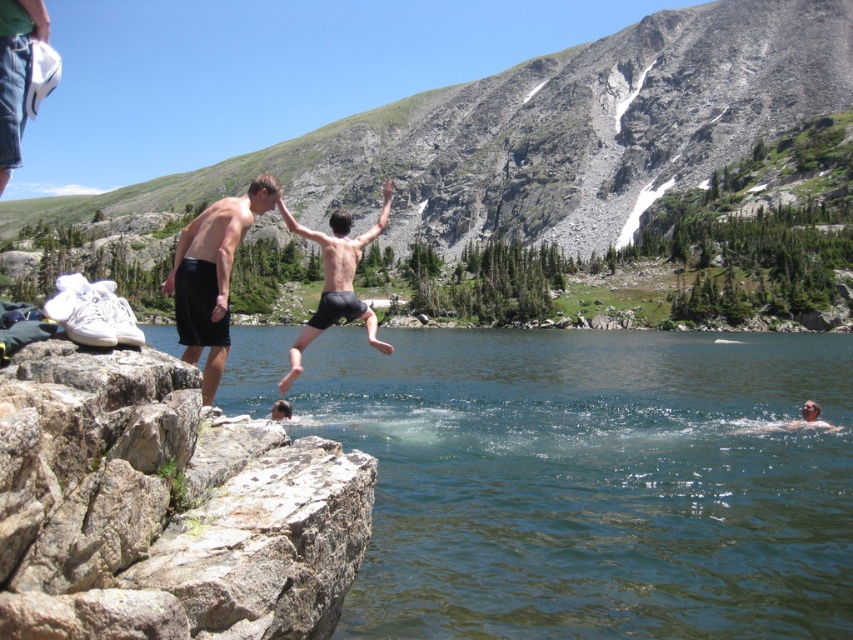
Question: Is clear water at cliff edge closer to camera compared to black matte shorts at left?

Choices:
 (A) yes
 (B) no

Answer: (B)

Question: Among these objects, which one is nearest to the camera?

Choices:
 (A) black matte shorts at center
 (B) black matte shorts at left

Answer: (B)

Question: Among these objects, which one is farthest from the camera?

Choices:
 (A) rough textured rock at left
 (B) black matte shorts at left
 (C) clear water at cliff edge

Answer: (C)

Question: Which point is closer to the camera?

Choices:
 (A) rough textured rock at left
 (B) black matte shorts at center

Answer: (A)

Question: Can you confirm if rough textured rock at left is smaller than black matte shorts at center?

Choices:
 (A) no
 (B) yes

Answer: (B)

Question: Is rough textured rock at left to the right of black matte shorts at center from the viewer's perspective?

Choices:
 (A) no
 (B) yes

Answer: (B)